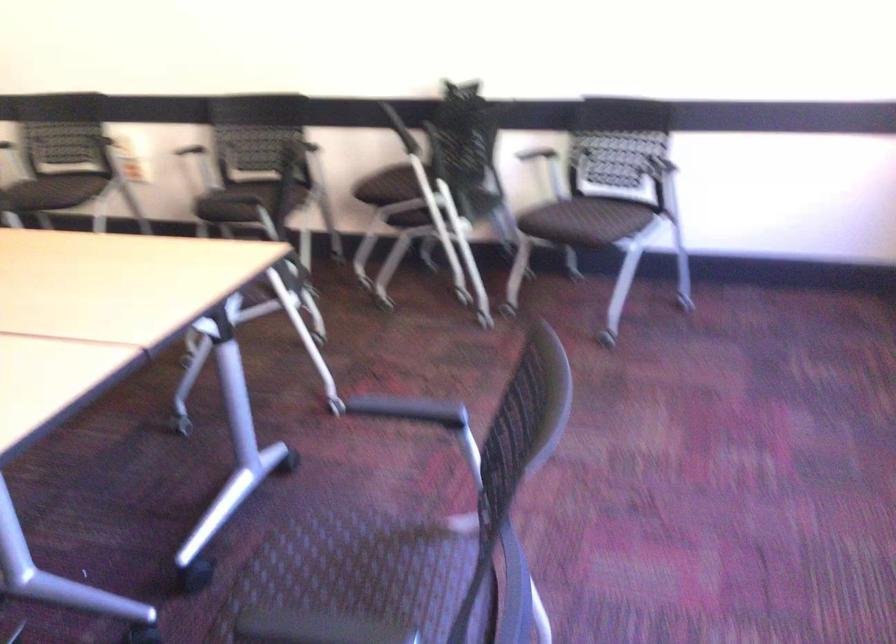
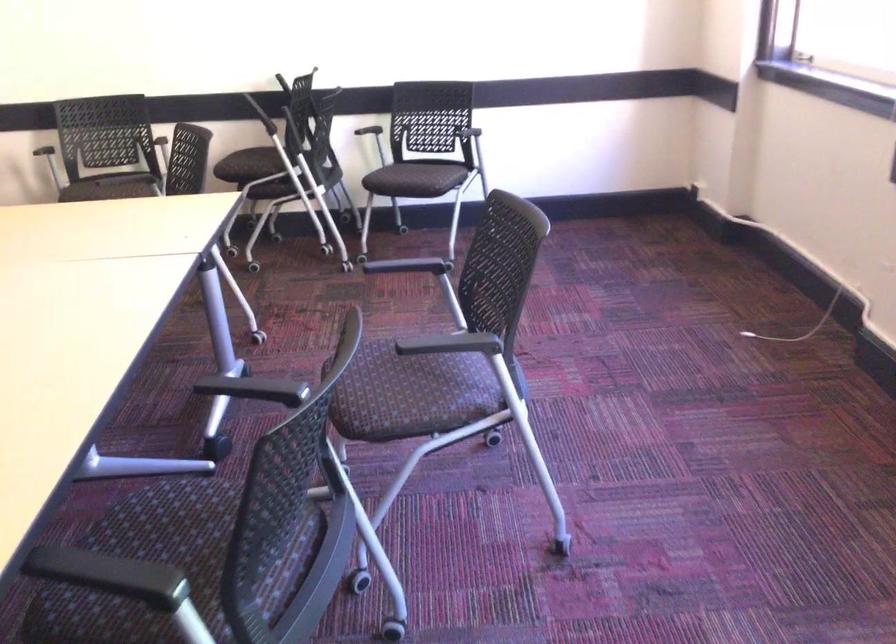
The point at (194,138) is marked in the first image. Where is the corresponding point in the second image?

(30, 140)